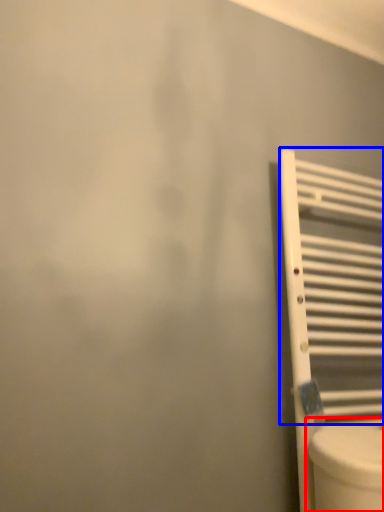
Question: Which object is further to the camera taking this photo, toilet (highlighted by a red box) or radiator (highlighted by a blue box)?

Choices:
 (A) toilet
 (B) radiator

Answer: (B)